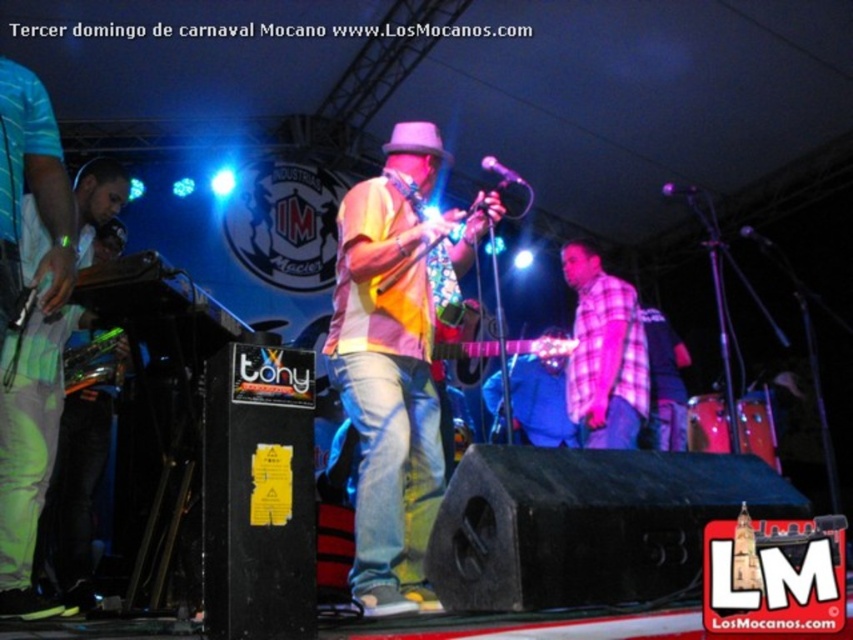
Question: Which point is farther from the camera taking this photo?

Choices:
 (A) (642, 356)
 (B) (358, 371)

Answer: (A)

Question: Does multicolored fabric shirt at center appear under pink plaid shirt at center?

Choices:
 (A) no
 (B) yes

Answer: (A)

Question: Where is multicolored fabric shirt at center located in relation to pink plaid shirt at center in the image?

Choices:
 (A) left
 (B) right

Answer: (A)

Question: Is multicolored fabric shirt at center thinner than pink plaid shirt at center?

Choices:
 (A) yes
 (B) no

Answer: (B)

Question: Among these points, which one is nearest to the camera?

Choices:
 (A) (395, 600)
 (B) (614, 324)

Answer: (A)